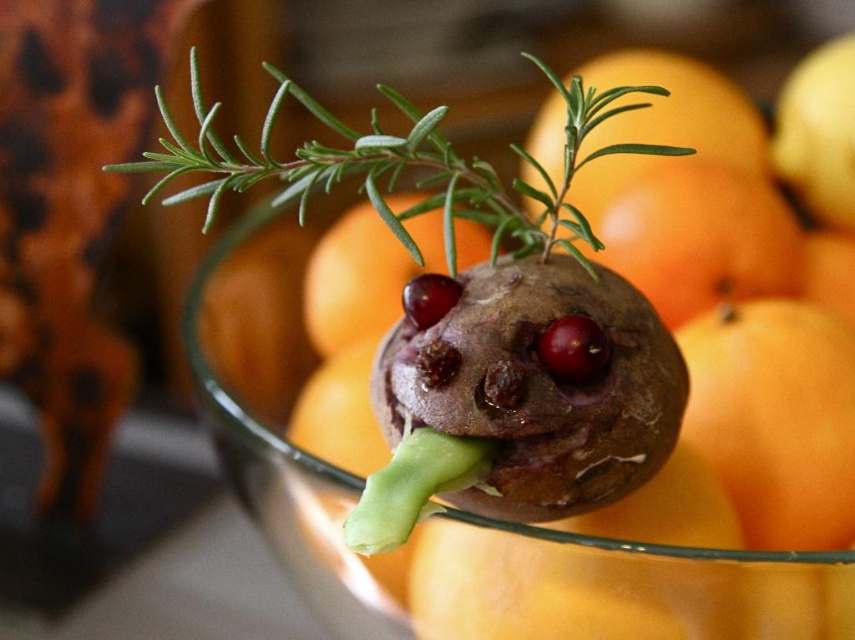
You are a food stylist arranging a reindeer cookie display. You have to place the green leafy rosemary at upper center and orange matte at upper center in such a way that they are both visible but not overlapping. Given their height difference, which object should be placed higher to ensure both are visible without overlapping?

The green leafy rosemary at upper center is taller than the orange matte at upper center, so to ensure both are visible without overlapping, the rosemary should be placed higher up so its height doesn

Looking at the food arrangement, where is the green leafy rosemary at upper center in relation to the glossy orange at center?

The green leafy rosemary at upper center is to the left of the glossy orange at center.

You are a food stylist arranging a reindeer cookie decoration. You have an orange matte at upper center and a shiny red cherry at center. Which object should you place first if you want the larger item to be positioned higher up?

The orange matte at upper center is larger than the shiny red cherry at center, so you should place the orange matte at upper center first to ensure it is positioned higher up.